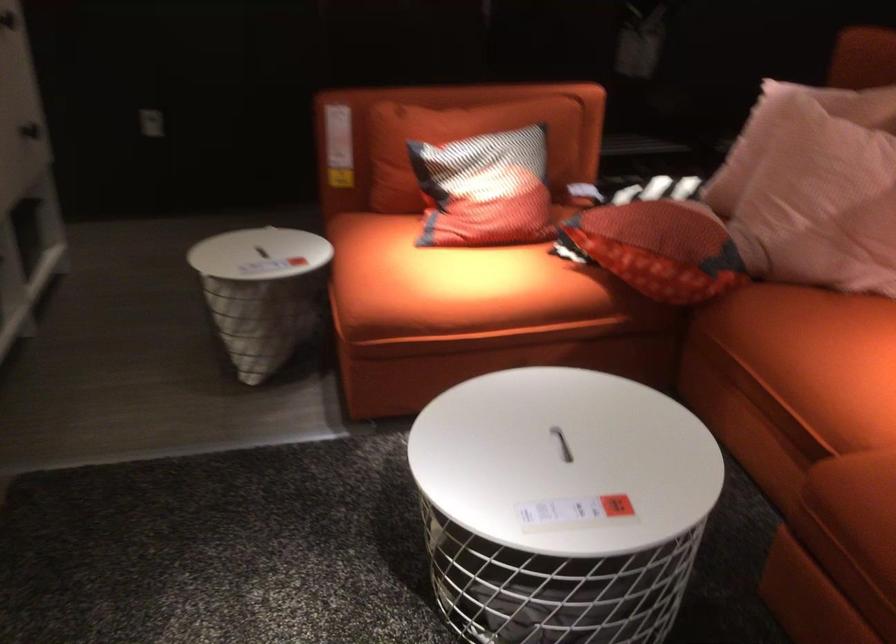
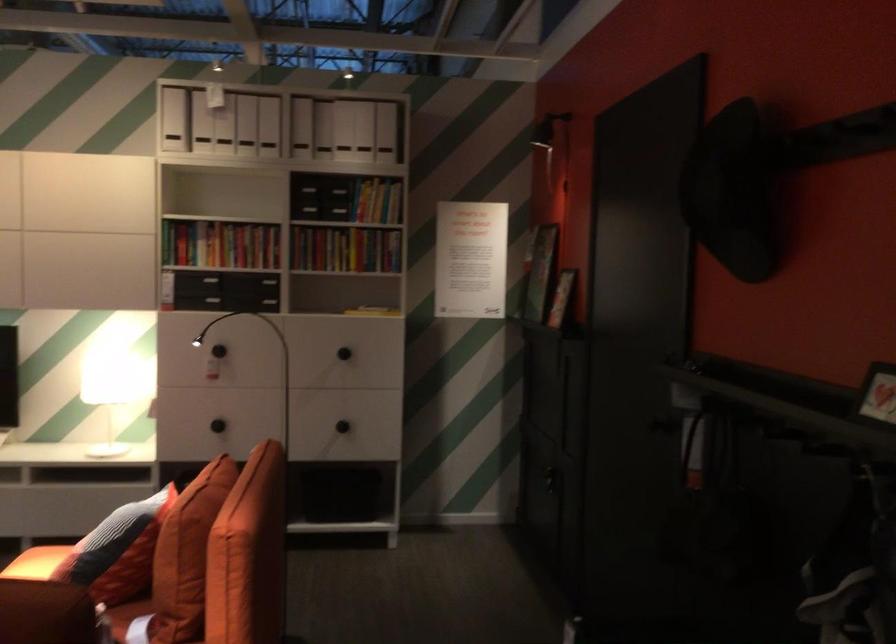
Locate, in the second image, the point that corresponds to (x=440, y=254) in the first image.

(36, 563)